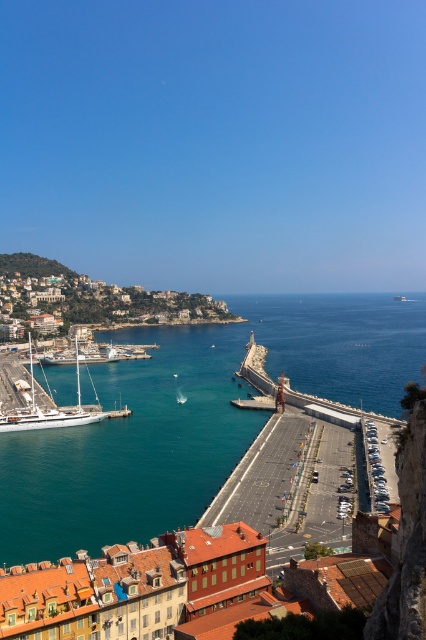
Who is higher up, teal glossy water at center or blue water at center?

Positioned higher is blue water at center.

Is point (17, 490) behind point (241, 296)?

No, (17, 490) is closer to viewer.

Is point (34, 486) farther from camera compared to point (301, 365)?

No, (34, 486) is closer to viewer.

Image resolution: width=426 pixels, height=640 pixels. In order to click on teal glossy water at center in this screenshot , I will do `click(131, 449)`.

Can you confirm if teal glossy water at center is smaller than white glossy sailboat at left?

No.

Does teal glossy water at center come behind white glossy sailboat at left?

No, teal glossy water at center is closer to the viewer.

Between point (215, 326) and point (23, 426), which one is positioned in front?

Positioned in front is point (23, 426).

What are the coordinates of `teal glossy water at center` in the screenshot? It's located at (131, 449).

Who is shorter, teal glossy water at center or matte stone buildings at left?

Standing shorter between the two is teal glossy water at center.

Is teal glossy water at center taller than matte stone buildings at left?

Incorrect, teal glossy water at center's height is not larger of matte stone buildings at left's.

Does point (192, 419) come closer to viewer compared to point (103, 304)?

Yes, point (192, 419) is closer to viewer.

The image size is (426, 640). In order to click on teal glossy water at center in this screenshot , I will do `click(131, 449)`.